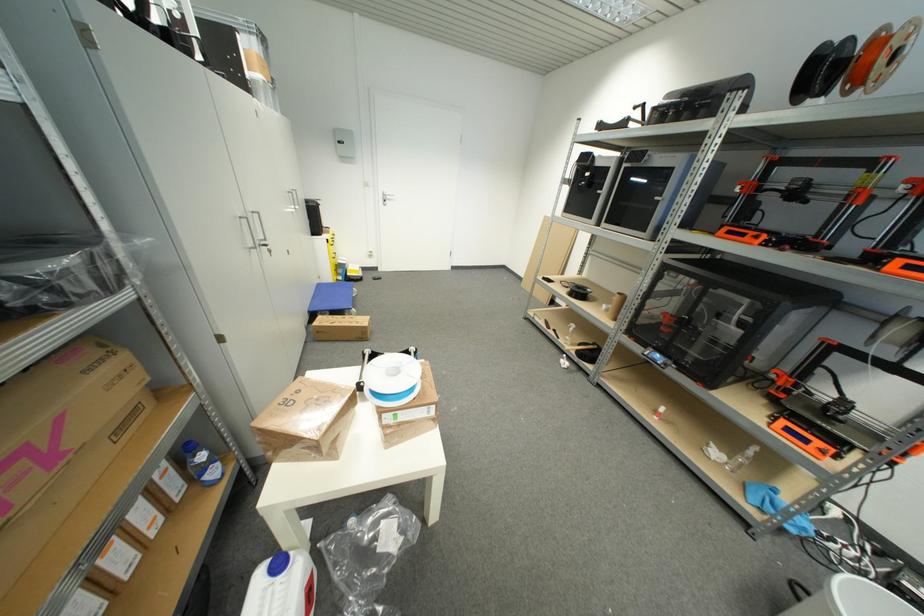
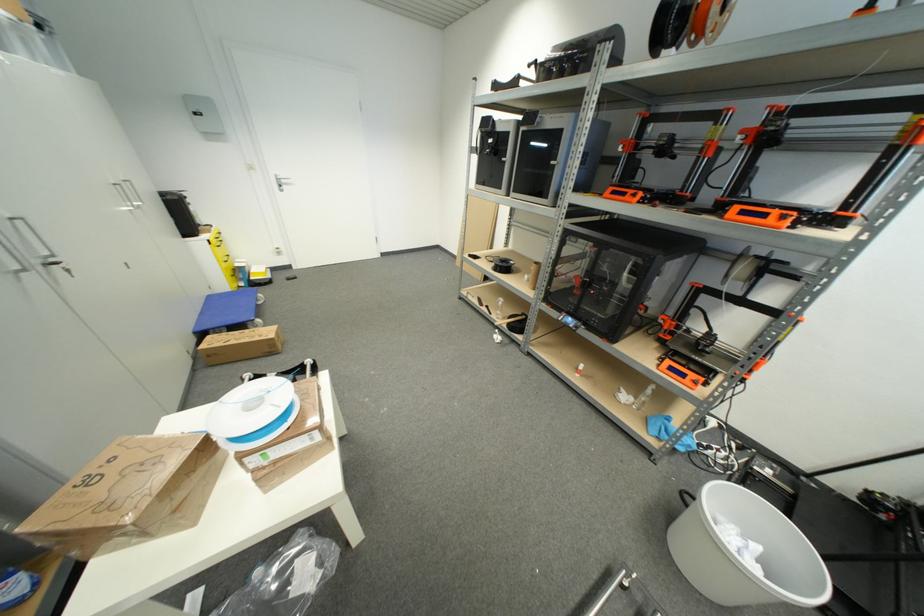
Where in the second image is the point corresponding to (x=323, y=320) from the first image?

(213, 339)